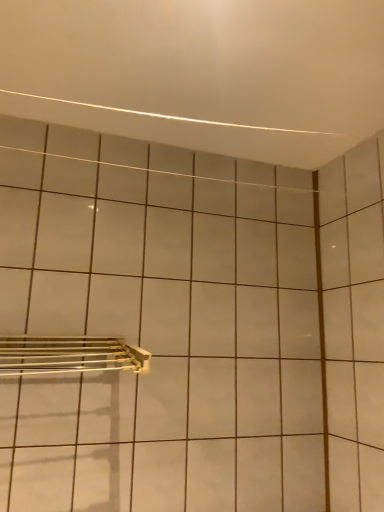
The image size is (384, 512). Describe the element at coordinates (69, 355) in the screenshot. I see `metallic silver towel rack at lower left` at that location.

Where is `metallic silver towel rack at lower left`? The width and height of the screenshot is (384, 512). metallic silver towel rack at lower left is located at coordinates (69, 355).

What are the coordinates of `metallic silver towel rack at lower left` in the screenshot? It's located at (69, 355).